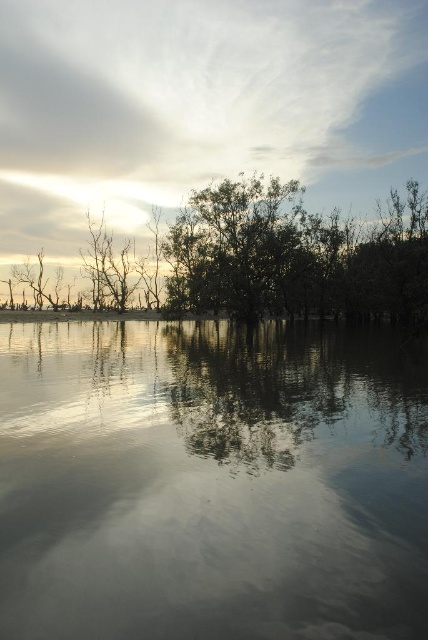
Question: Which object is positioned closest to the bare branches at left?

Choices:
 (A) white fluffy cloud at upper center
 (B) silvery metallic trees at upper center

Answer: (B)

Question: Can you confirm if smooth reflective water at center is smaller than bare branches at left?

Choices:
 (A) yes
 (B) no

Answer: (B)

Question: Which object appears closest to the camera in this image?

Choices:
 (A) silvery metallic trees at upper center
 (B) white fluffy cloud at upper center

Answer: (A)

Question: Is smooth reflective water at center below bare branches at left?

Choices:
 (A) no
 (B) yes

Answer: (B)

Question: Can you confirm if smooth reflective water at center is thinner than white fluffy cloud at upper center?

Choices:
 (A) no
 (B) yes

Answer: (B)

Question: Among these objects, which one is farthest from the camera?

Choices:
 (A) white fluffy cloud at upper center
 (B) smooth reflective water at center
 (C) silvery metallic trees at upper center
 (D) bare branches at left

Answer: (D)